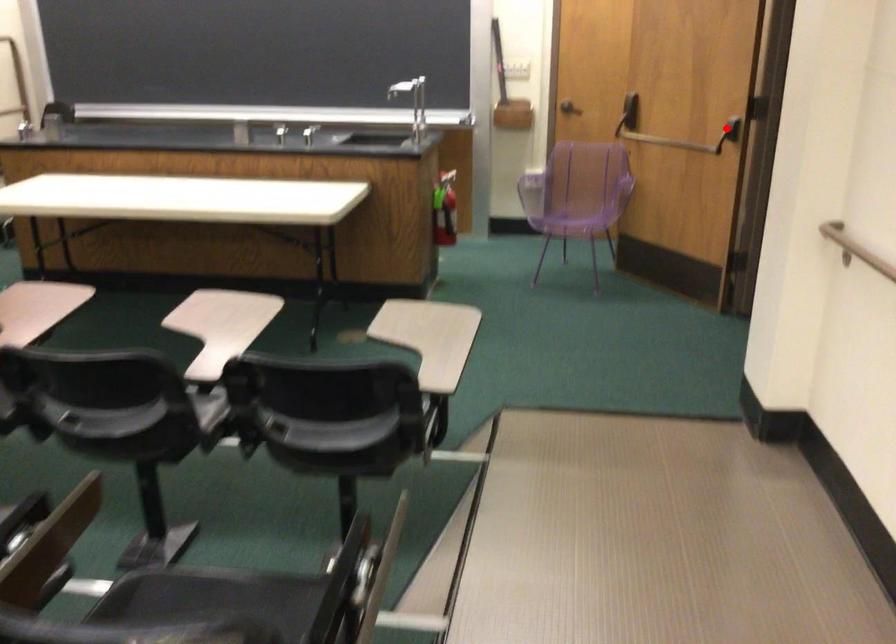
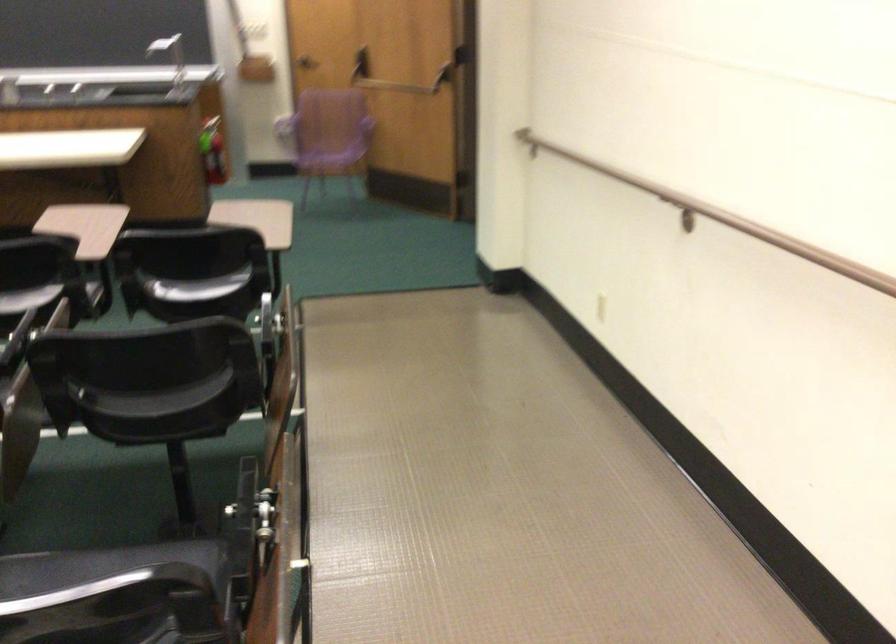
Question: I am providing you with two images of the same scene from different viewpoints. Given a red point in image1, look at the same physical point in image2. Is it:

Choices:
 (A) Closer to the viewpoint
 (B) Farther from the viewpoint

Answer: (B)